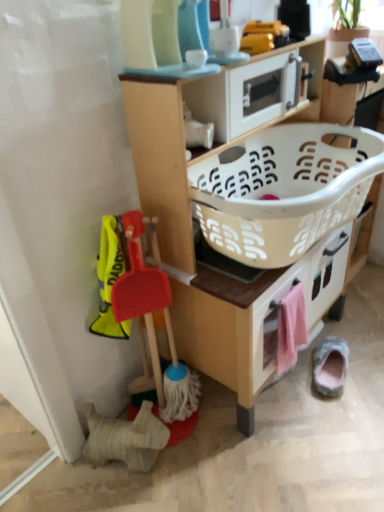
Question: Is wooden toy kitchen at center wider or thinner than white plastic microwave at upper center?

Choices:
 (A) thin
 (B) wide

Answer: (B)

Question: Considering the relative positions of wooden toy kitchen at center and white plastic microwave at upper center in the image provided, is wooden toy kitchen at center to the left or to the right of white plastic microwave at upper center?

Choices:
 (A) right
 (B) left

Answer: (A)

Question: Estimate the real-world distances between objects in this image. Which object is closer to the pink fabric drawer at lower right?

Choices:
 (A) wooden toy kitchen at center
 (B) white plastic microwave at upper center
 (C) gray suede slipper at lower right
 (D) white plastic basket at center

Answer: (A)

Question: Which object is positioned farthest from the pink fabric drawer at lower right?

Choices:
 (A) white plastic microwave at upper center
 (B) gray suede slipper at lower right
 (C) white plastic basket at center
 (D) wooden toy kitchen at center

Answer: (A)